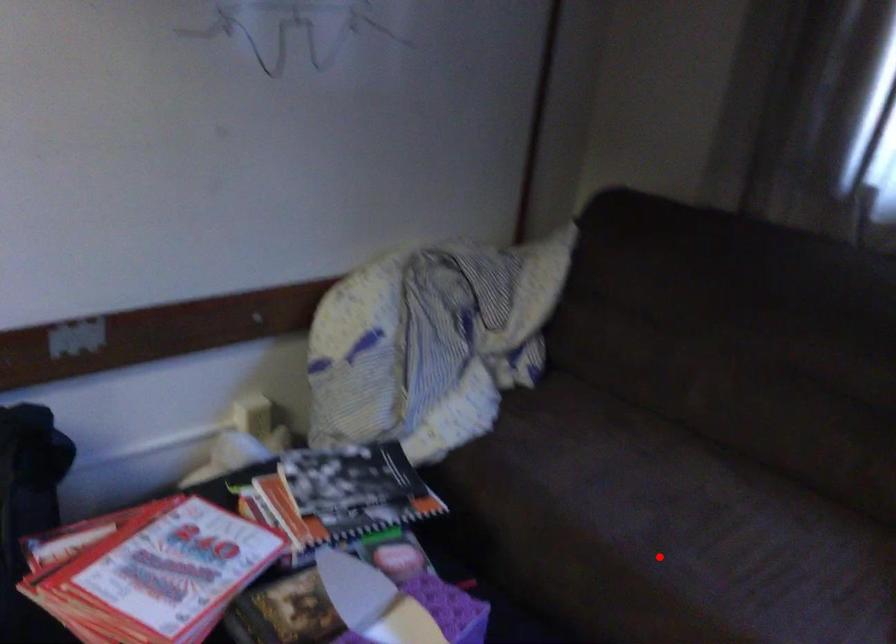
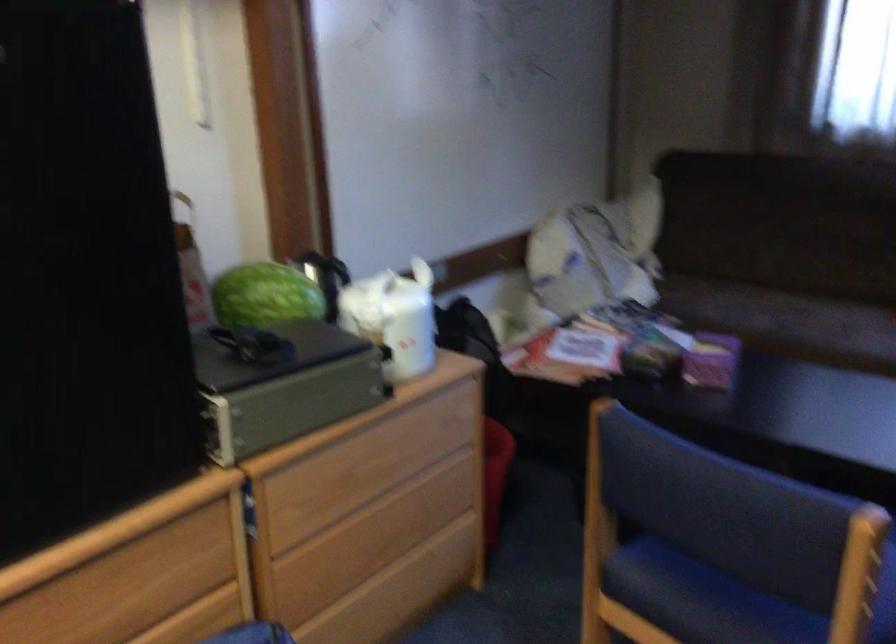
Question: A red point is marked in image1. In image2, is the corresponding 3D point closer to the camera or farther? Reply with the corresponding letter.

Choices:
 (A) The corresponding 3D point is closer.
 (B) The corresponding 3D point is farther.

Answer: (B)